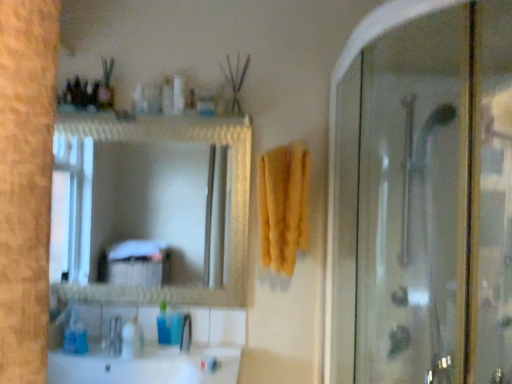
Question: From the image's perspective, is blue plastic bottle at lower center, the third toiletry when ordered from right to left, beneath yellow soft towel at center?

Choices:
 (A) yes
 (B) no

Answer: (A)

Question: Is the position of blue plastic bottle at lower center, acting as the 2th toiletry starting from the left, more distant than that of yellow soft towel at center?

Choices:
 (A) no
 (B) yes

Answer: (B)

Question: Does blue plastic bottle at lower center, which is the 2th toiletry from top to bottom, have a greater width compared to yellow soft towel at center?

Choices:
 (A) no
 (B) yes

Answer: (A)

Question: Is blue plastic bottle at lower center, the third toiletry when ordered from right to left, at the left side of yellow soft towel at center?

Choices:
 (A) no
 (B) yes

Answer: (B)

Question: Does blue plastic bottle at lower center, acting as the 2th toiletry starting from the left, have a greater height compared to yellow soft towel at center?

Choices:
 (A) yes
 (B) no

Answer: (B)

Question: Considering the positions of blue plastic bottle at lower center, the third toiletry when ordered from right to left, and translucent plastic soap dispenser at lower left, marked as the 1th toiletry in a left-to-right arrangement, in the image, is blue plastic bottle at lower center, the third toiletry when ordered from right to left, taller or shorter than translucent plastic soap dispenser at lower left, marked as the 1th toiletry in a left-to-right arrangement,?

Choices:
 (A) short
 (B) tall

Answer: (B)

Question: Does point (160, 306) appear closer or farther from the camera than point (131, 357)?

Choices:
 (A) farther
 (B) closer

Answer: (A)

Question: In the image, is blue plastic bottle at lower center, which is the 2th toiletry from top to bottom, positioned in front of or behind translucent plastic soap dispenser at lower left, the 3th toiletry viewed from the top?

Choices:
 (A) behind
 (B) front

Answer: (A)

Question: Is blue plastic bottle at lower center, which is the 2th toiletry from top to bottom, situated inside translucent plastic soap dispenser at lower left, marked as the 1th toiletry in a left-to-right arrangement, or outside?

Choices:
 (A) outside
 (B) inside

Answer: (A)

Question: Is transparent glass shower door at right situated inside yellow soft towel at center or outside?

Choices:
 (A) inside
 (B) outside

Answer: (B)

Question: Is transparent glass shower door at right in front of or behind yellow soft towel at center in the image?

Choices:
 (A) front
 (B) behind

Answer: (A)

Question: Is point (366, 218) closer or farther from the camera than point (296, 167)?

Choices:
 (A) farther
 (B) closer

Answer: (A)

Question: From the image's perspective, is transparent glass shower door at right positioned above or below yellow soft towel at center?

Choices:
 (A) above
 (B) below

Answer: (B)

Question: From a real-world perspective, relative to blue plastic cup at lower center, which is counted as the first toiletry, starting from the right, is translucent plastic bottle at upper center, which ranks as the 2th toiletry in right-to-left order, vertically above or below?

Choices:
 (A) above
 (B) below

Answer: (A)

Question: Is translucent plastic bottle at upper center, placed as the 1th toiletry when sorted from top to bottom, to the left or to the right of blue plastic cup at lower center, which is the 4th toiletry from left to right, in the image?

Choices:
 (A) left
 (B) right

Answer: (A)